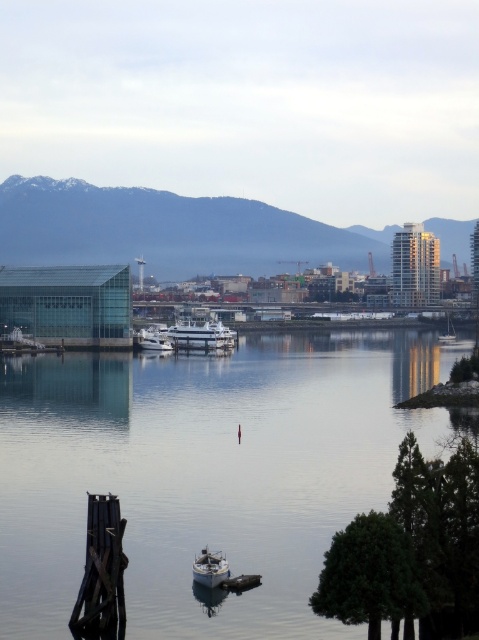
Question: Among these objects, which one is farthest from the camera?

Choices:
 (A) dark gray wood dock at lower left
 (B) white matte sailboat at right
 (C) white glossy boat at center

Answer: (B)

Question: Which point is closer to the camera?

Choices:
 (A) 206,497
 (B) 225,568
 (C) 443,340

Answer: (B)

Question: Is clear water at center bigger than white glossy yacht at center?

Choices:
 (A) no
 (B) yes

Answer: (B)

Question: Which object appears closest to the camera in this image?

Choices:
 (A) clear water at center
 (B) white glossy boat at center
 (C) dark gray wood dock at lower left
 (D) white matte sailboat at right

Answer: (A)

Question: Where is clear water at center located in relation to white matte sailboat at right in the image?

Choices:
 (A) right
 (B) left

Answer: (B)

Question: Can you confirm if clear water at center is thinner than dark gray wood dock at lower left?

Choices:
 (A) yes
 (B) no

Answer: (B)